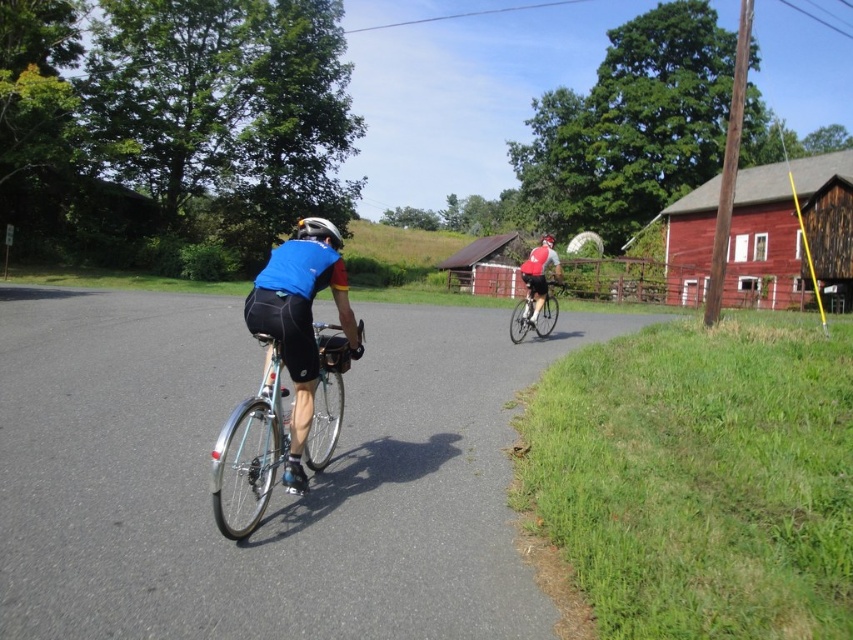
You are a photographer standing at the starting point of the road. You want to take a photo of the shiny silver bicycle at right and the white matte bicycle helmet at center. Based on their positions, which object will appear closer to the top of the photo?

The white matte bicycle helmet at center is positioned above the shiny silver bicycle at right, so it will appear closer to the top of the photo.

In the scene shown: You are a delivery person who needs to attach a GPS tracker to the shiny silver bicycle at right. The GPS tracker must be placed exactly at point (532, 312). Can you confirm the location of this point on the shiny silver bicycle at right?

The point (532, 312) is located on the shiny silver bicycle at right, so you can attach the GPS tracker there.